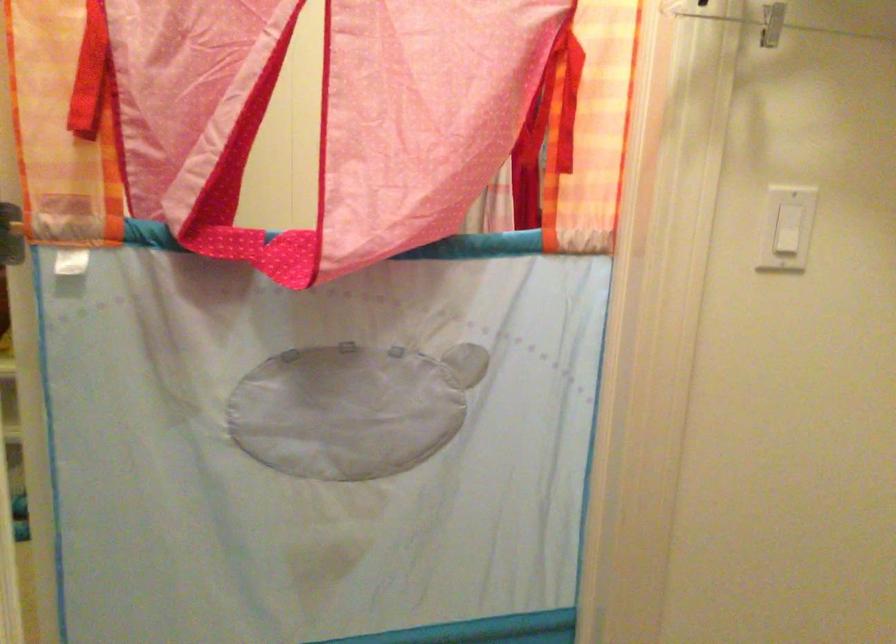
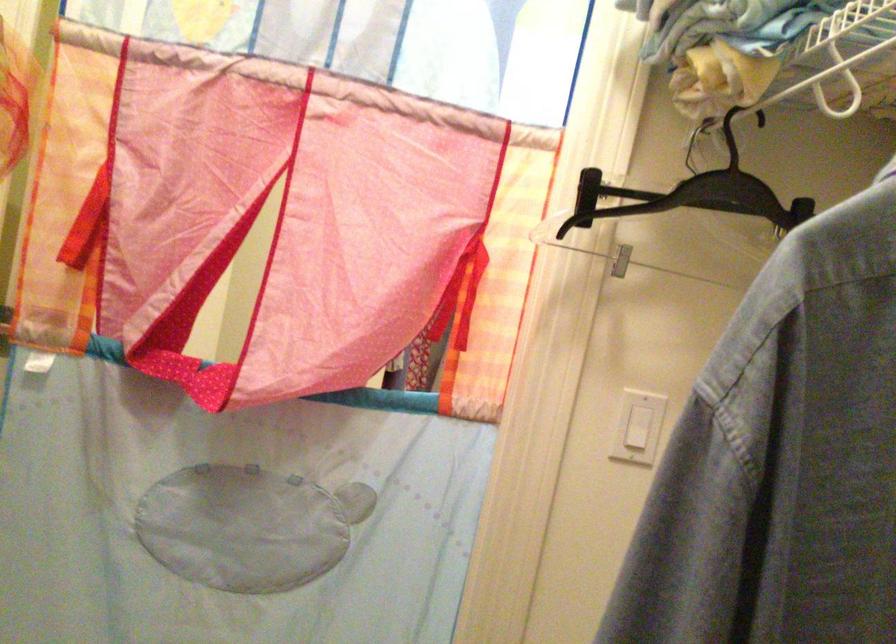
Where in the second image is the point corresponding to [257,252] from the first image?

(188, 375)